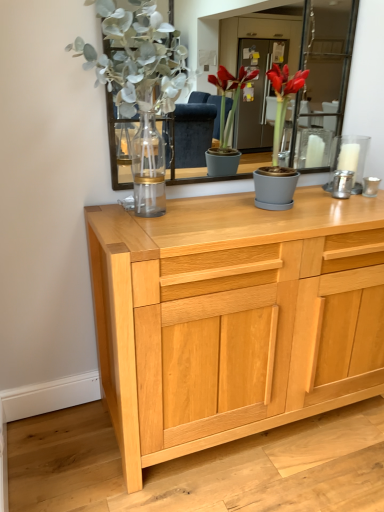
Locate an element on the screen. vacant space in matte glass vase at upper left (from a real-world perspective) is located at coordinates (137, 218).